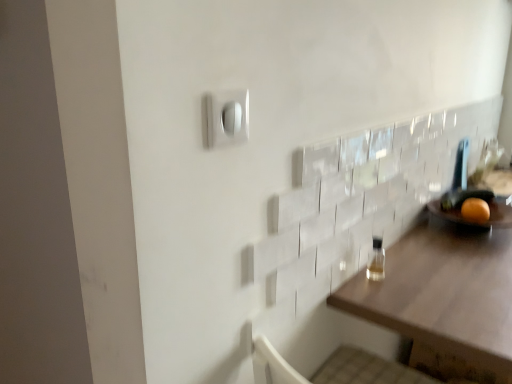
Question: From the image's perspective, is orange matte at right above or below brown wooden table at right?

Choices:
 (A) below
 (B) above

Answer: (B)

Question: Considering the positions of orange matte at right and brown wooden table at right in the image, is orange matte at right wider or thinner than brown wooden table at right?

Choices:
 (A) thin
 (B) wide

Answer: (A)

Question: Estimate the real-world distances between objects in this image. Which object is farther from the clear glass bottle at right?

Choices:
 (A) brown wooden table at right
 (B) white plastic light switch at upper center
 (C) orange matte at right

Answer: (B)

Question: Which of these objects is positioned closest to the orange matte at right?

Choices:
 (A) white plastic light switch at upper center
 (B) clear glass bottle at right
 (C) brown wooden table at right

Answer: (C)